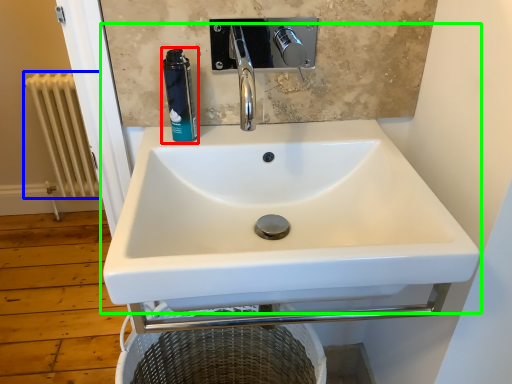
Question: Considering the real-world distances, which object is farthest from mouthwash (highlighted by a red box)? radiator (highlighted by a blue box) or sink (highlighted by a green box)?

Choices:
 (A) radiator
 (B) sink

Answer: (A)